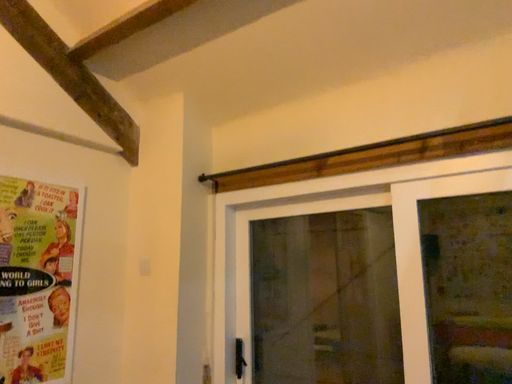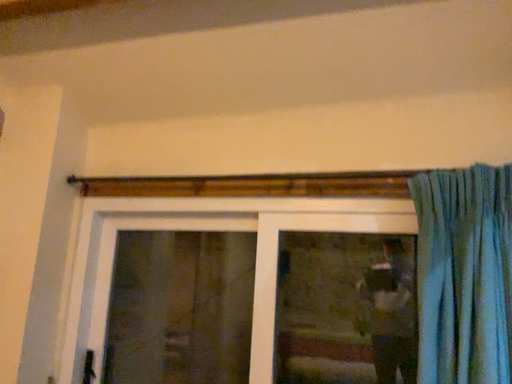
Question: Which way did the camera rotate in the video?

Choices:
 (A) rotated right
 (B) rotated left

Answer: (A)